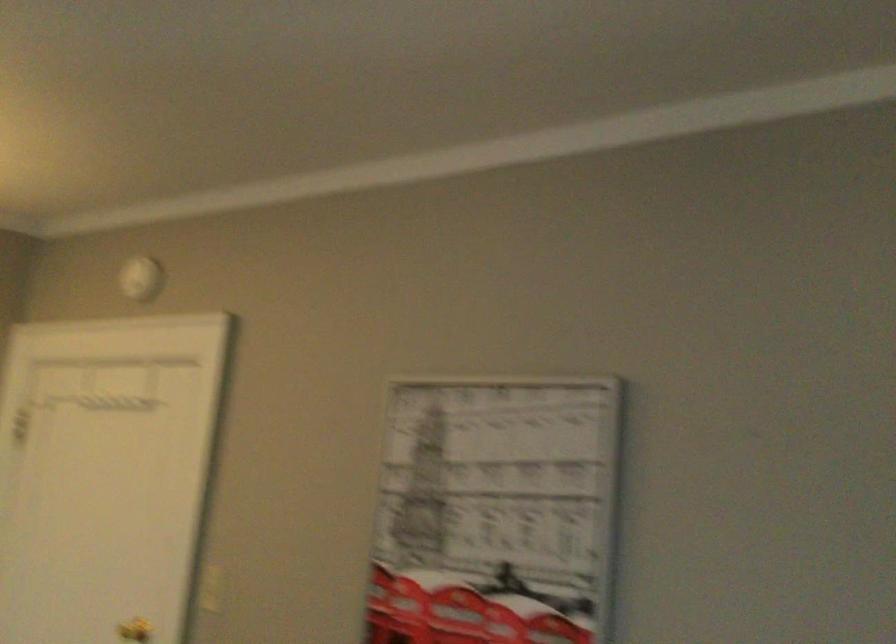
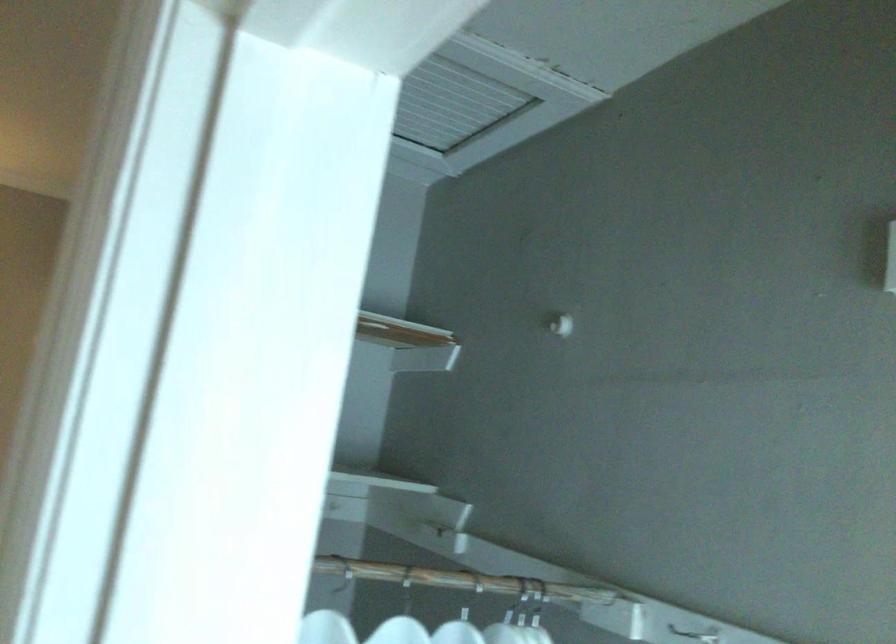
In a continuous first-person perspective shot, in which direction is the camera moving?

The cameraman moved toward right, forward.